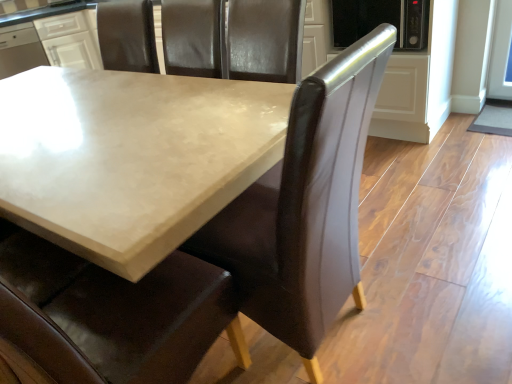
I want to click on vacant area that lies to the right of brown leather chair at center, so click(419, 299).